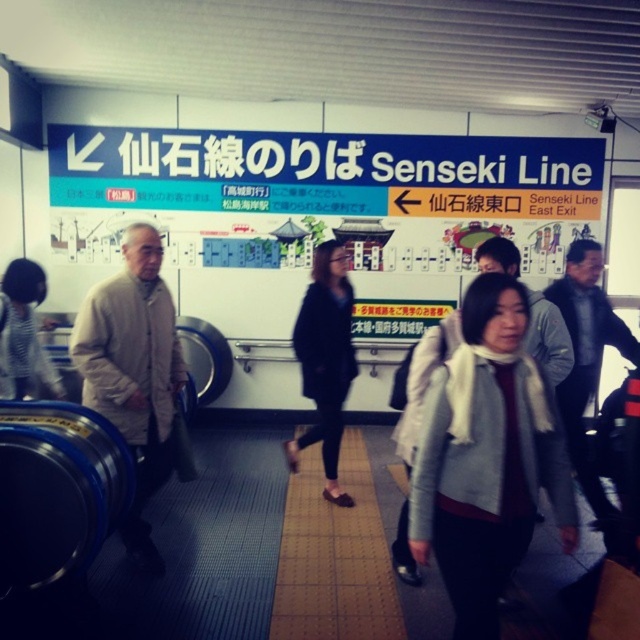
Is light beige sweater at left closer to the viewer compared to striped fabric jacket at center?

Yes.

Can you confirm if light beige sweater at left is positioned to the left of striped fabric jacket at center?

Incorrect, light beige sweater at left is not on the left side of striped fabric jacket at center.

Who is more distant from viewer, (125, 387) or (26, 364)?

Point (26, 364)

You are a GUI agent. You are given a task and a screenshot of the screen. Output one action in this format:
    pyautogui.click(x=<x>, y=<y>)
    Task: Click on the light beige sweater at left
    The image size is (640, 640).
    Given the screenshot: What is the action you would take?
    pyautogui.click(x=132, y=371)

Does white woolen scarf at center appear over black leather jacket at center?

Actually, white woolen scarf at center is below black leather jacket at center.

Does white woolen scarf at center appear on the left side of black leather jacket at center?

No, white woolen scarf at center is not to the left of black leather jacket at center.

Is point (474, 448) positioned behind point (337, 442)?

That is False.

Locate an element on the screen. The image size is (640, 640). white woolen scarf at center is located at coordinates (486, 458).

Who is lower down, white woolen scarf at center or light beige sweater at left?

Positioned lower is white woolen scarf at center.

Consider the image. Which is more to the left, white woolen scarf at center or light beige sweater at left?

light beige sweater at left

Who is more forward, (428,541) or (140,422)?

Point (428,541) is more forward.

Find the location of a particular element. Image resolution: width=640 pixels, height=640 pixels. white woolen scarf at center is located at coordinates (486, 458).